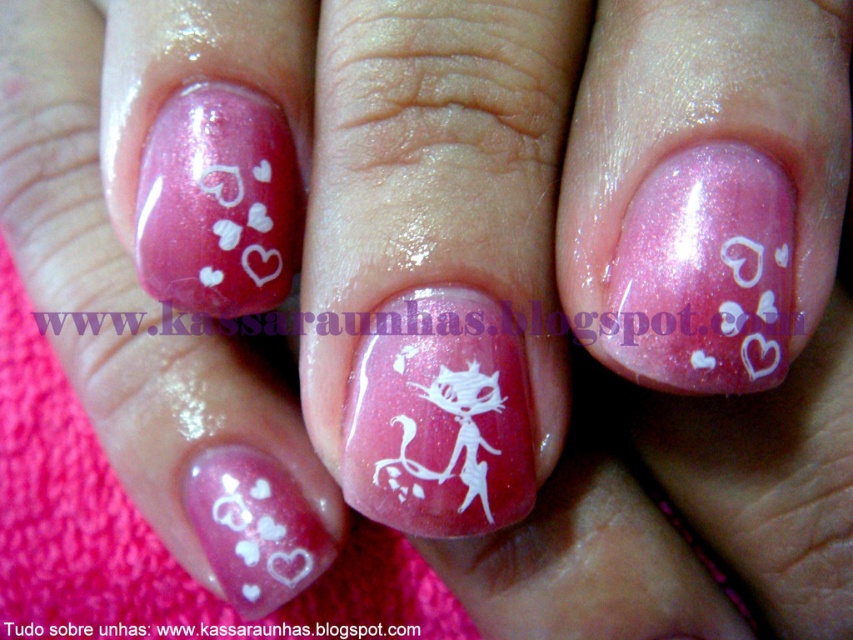
Which is above, white glossy cat at center or pink glossy hearts at upper left?

pink glossy hearts at upper left

Is white glossy cat at center behind pink glossy hearts at upper left?

No, white glossy cat at center is closer to the viewer.

Identify the location of white glossy cat at center. (439, 417).

Is pink glitter nail polish at center above white glossy cat at center?

Indeed, pink glitter nail polish at center is positioned over white glossy cat at center.

Is the position of pink glitter nail polish at center less distant than that of white glossy cat at center?

That is True.

Is point (772, 176) more distant than point (502, 371)?

That is False.

Where is `pink glitter nail polish at center`? The height and width of the screenshot is (640, 853). pink glitter nail polish at center is located at coordinates (703, 275).

Is pink glitter nail polish at center thinner than pink glossy hearts at upper left?

In fact, pink glitter nail polish at center might be wider than pink glossy hearts at upper left.

Can you confirm if pink glitter nail polish at center is bigger than pink glossy hearts at upper left?

Yes, pink glitter nail polish at center is bigger than pink glossy hearts at upper left.

The height and width of the screenshot is (640, 853). What are the coordinates of `pink glitter nail polish at center` in the screenshot? It's located at (703, 275).